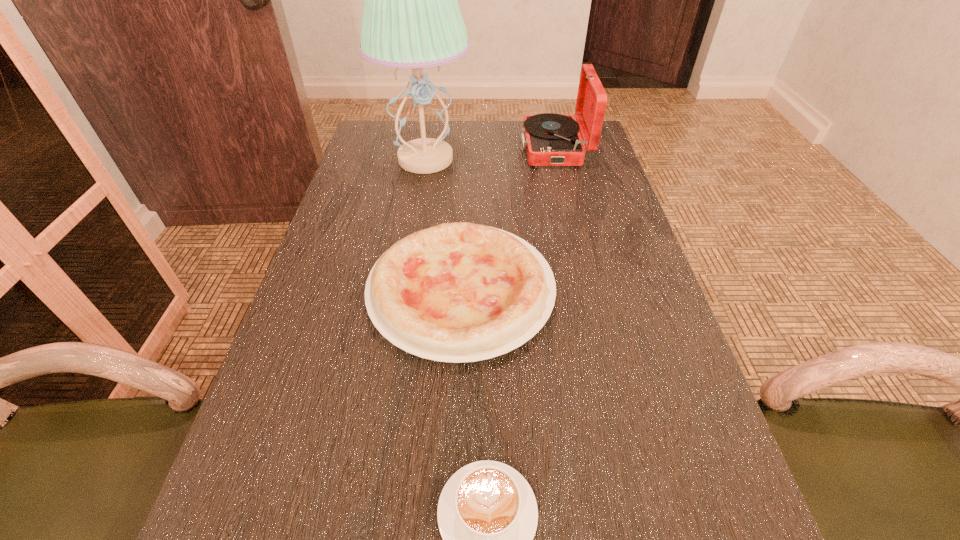
The width and height of the screenshot is (960, 540). I want to click on the tallest object, so click(x=411, y=18).

The height and width of the screenshot is (540, 960). Identify the location of phonograph_record. (550, 139).

Find the location of a particular element. The width and height of the screenshot is (960, 540). pizza is located at coordinates (457, 292).

You are a GUI agent. You are given a task and a screenshot of the screen. Output one action in this format:
    pyautogui.click(x=<x>, y=<y>)
    Task: Click on the free space located on the back of the lamp
    
    Given the screenshot: What is the action you would take?
    pyautogui.click(x=432, y=123)

Identify the location of vacant area situated 0.140m on the front-facing side of the phonograph_record. (478, 148).

You are a GUI agent. You are given a task and a screenshot of the screen. Output one action in this format:
    pyautogui.click(x=<x>, y=<y>)
    Task: Click on the free space located 0.260m on the front-facing side of the phonograph_record
    
    Given the screenshot: What is the action you would take?
    pyautogui.click(x=440, y=148)

Where is `vacant space located 0.050m on the front-facing side of the phonograph_record`? Image resolution: width=960 pixels, height=540 pixels. vacant space located 0.050m on the front-facing side of the phonograph_record is located at coordinates (506, 148).

Where is `blank area located on the front of the second nearest object`? This screenshot has width=960, height=540. blank area located on the front of the second nearest object is located at coordinates (453, 477).

Where is `lamp at the far edge`? lamp at the far edge is located at coordinates (411, 18).

Identify the location of phonograph_record at the far edge. (550, 139).